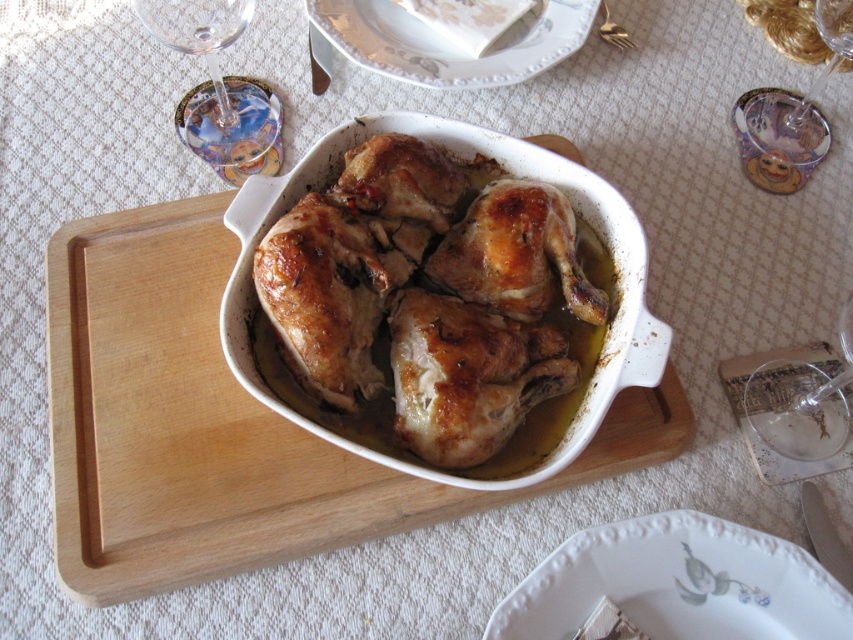
You are a guest at a dinner party and see the transparent glass at upper right and the gold metallic fork at upper center on the table. Which item is positioned to the right side of the other?

The transparent glass at upper right is to the right of the gold metallic fork at upper center.

You are a guest at a dinner party and want to serve yourself a piece of the golden crispy chicken at center. The transparent glass at lower right is in your way. Can you move the glass to the side to reach the chicken?

The golden crispy chicken at center is larger than the transparent glass at lower right, so you can move the transparent glass at lower right out of the way to reach the golden crispy chicken at center since the glass is smaller and easier to move.